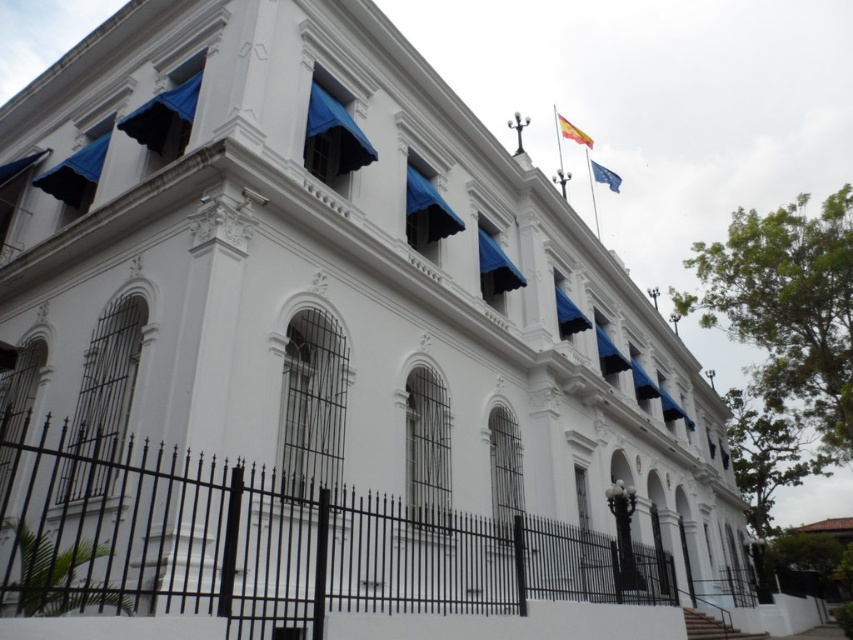
Does yellow fabric flag at upper center appear on the left side of blue fabric flag at upper center?

Yes, yellow fabric flag at upper center is to the left of blue fabric flag at upper center.

The image size is (853, 640). What are the coordinates of `yellow fabric flag at upper center` in the screenshot? It's located at (573, 131).

Is black wrought iron fence at lower center smaller than yellow fabric flag at upper center?

Indeed, black wrought iron fence at lower center has a smaller size compared to yellow fabric flag at upper center.

Is black wrought iron fence at lower center positioned behind yellow fabric flag at upper center?

No, black wrought iron fence at lower center is closer to the viewer.

Which is in front, point (96, 496) or point (564, 125)?

Positioned in front is point (96, 496).

Where is `black wrought iron fence at lower center`? This screenshot has width=853, height=640. black wrought iron fence at lower center is located at coordinates (271, 541).

Which is below, black wrought iron fence at lower center or blue fabric flag at upper center?

Positioned lower is black wrought iron fence at lower center.

Between point (239, 484) and point (596, 170), which one is positioned behind?

The point (596, 170) is more distant.

Is point (47, 522) closer to camera compared to point (601, 179)?

That is True.

Identify the location of black wrought iron fence at lower center. Image resolution: width=853 pixels, height=640 pixels. (271, 541).